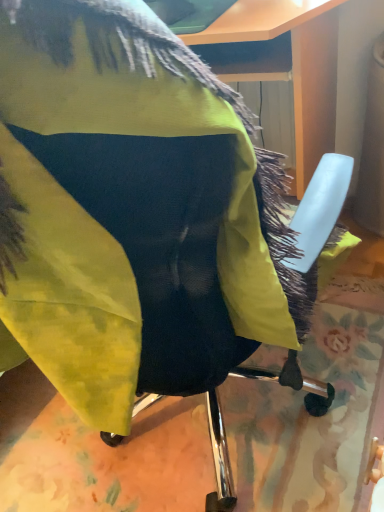
The image size is (384, 512). What do you see at coordinates (320, 210) in the screenshot? I see `matte black mesh chair at center` at bounding box center [320, 210].

Identify the location of matte black mesh chair at center. (320, 210).

Where is `matte black mesh chair at center`? The height and width of the screenshot is (512, 384). matte black mesh chair at center is located at coordinates (320, 210).